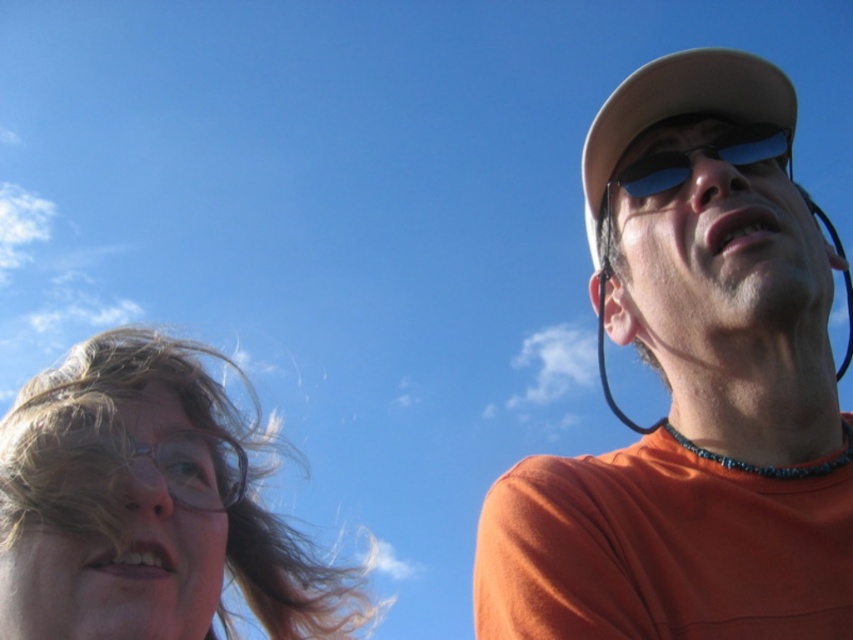
Does translucent plastic glasses at left have a greater width compared to sunglasses at upper right?

Indeed, translucent plastic glasses at left has a greater width compared to sunglasses at upper right.

Is point (90, 396) behind point (722, 138)?

Yes, it is.

Find the location of `translucent plastic glasses at left`. translucent plastic glasses at left is located at coordinates (148, 506).

Where is `translucent plastic glasses at left`? translucent plastic glasses at left is located at coordinates (148, 506).

Find the location of a particular element. The image size is (853, 640). orange matte shirt at right is located at coordinates (692, 387).

Can you confirm if orange matte shirt at right is taller than translucent plastic glasses at left?

Yes, orange matte shirt at right is taller than translucent plastic glasses at left.

Locate an element on the screen. orange matte shirt at right is located at coordinates (692, 387).

Find the location of `orange matte shirt at right`. orange matte shirt at right is located at coordinates (692, 387).

Between point (544, 625) and point (647, 172), which one is positioned behind?

Point (647, 172)

Identify the location of orange matte shirt at right. (692, 387).

The height and width of the screenshot is (640, 853). Find the location of `orange matte shirt at right`. orange matte shirt at right is located at coordinates (692, 387).